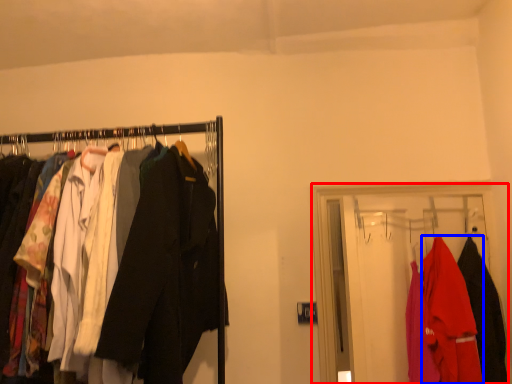
Question: Which point is further to the camera, closet (highlighted by a red box) or fancy dress (highlighted by a blue box)?

Choices:
 (A) closet
 (B) fancy dress

Answer: (A)